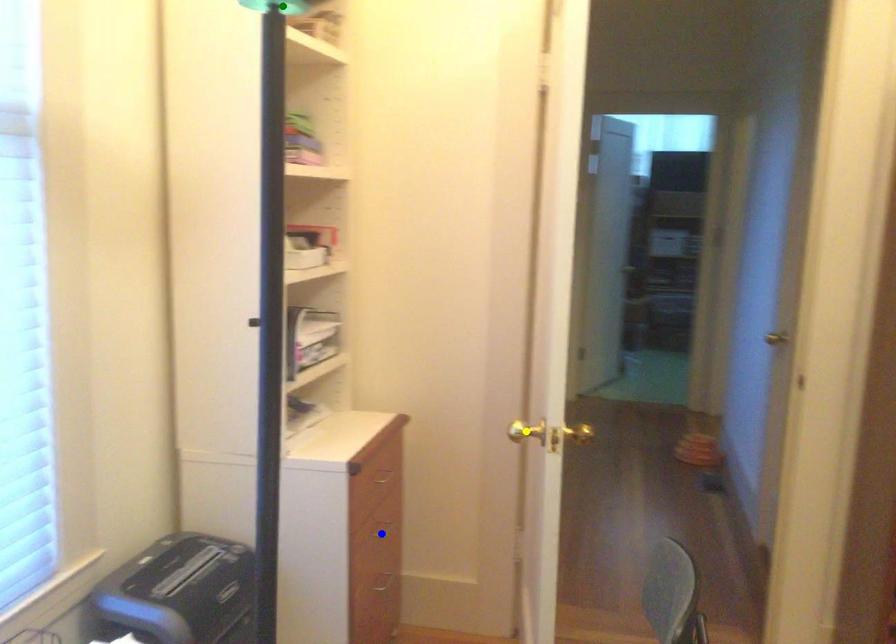
Order these from nearest to farthest:
yellow point
green point
blue point

1. green point
2. blue point
3. yellow point